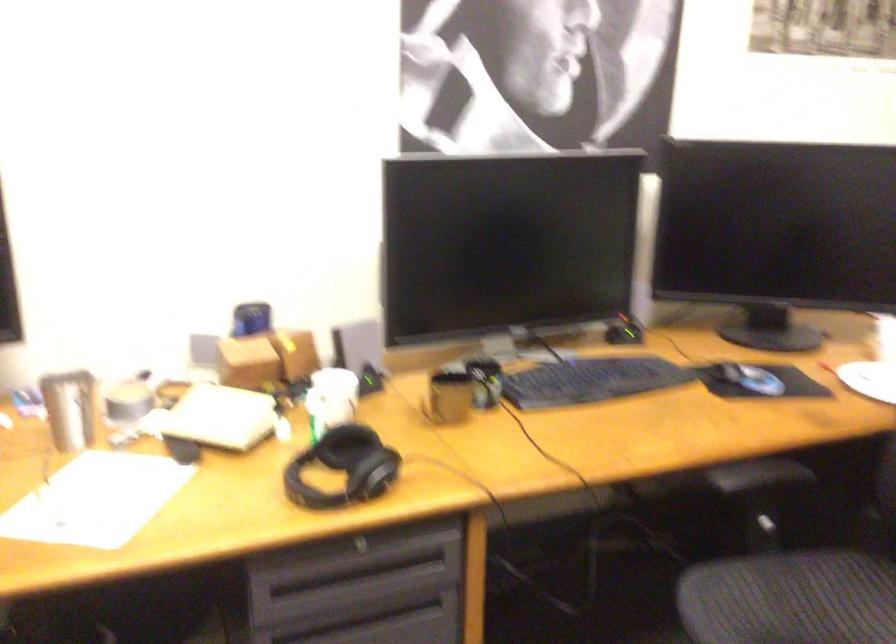
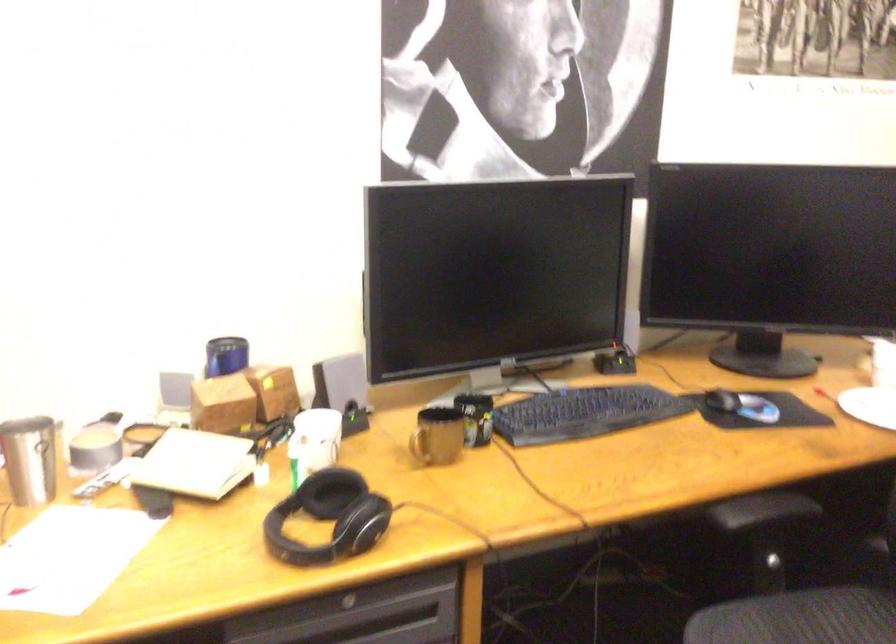
The point at (293, 354) is marked in the first image. Where is the corresponding point in the second image?

(272, 392)